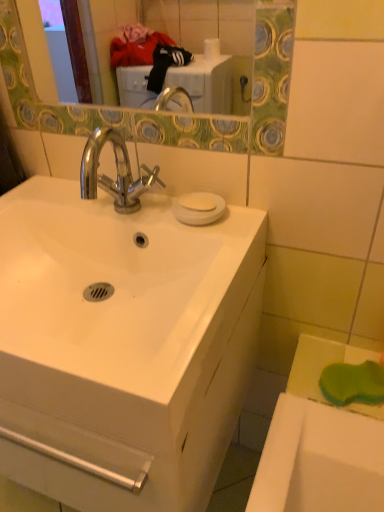
Question: Are white glossy sink at center and white matte soap at upper center beside each other?

Choices:
 (A) no
 (B) yes

Answer: (A)

Question: From a real-world perspective, does white glossy sink at center sit lower than white matte soap at upper center?

Choices:
 (A) no
 (B) yes

Answer: (B)

Question: Considering the relative positions of white glossy sink at center and white matte soap at upper center in the image provided, is white glossy sink at center to the left of white matte soap at upper center from the viewer's perspective?

Choices:
 (A) no
 (B) yes

Answer: (B)

Question: Considering the relative sizes of white glossy sink at center and white matte soap at upper center in the image provided, is white glossy sink at center shorter than white matte soap at upper center?

Choices:
 (A) yes
 (B) no

Answer: (B)

Question: Is white glossy sink at center bigger than white matte soap at upper center?

Choices:
 (A) no
 (B) yes

Answer: (B)

Question: Does point (66, 485) appear closer or farther from the camera than point (185, 202)?

Choices:
 (A) farther
 (B) closer

Answer: (B)

Question: Visually, is white glossy cabinet at center positioned to the left or to the right of white matte soap at upper center?

Choices:
 (A) right
 (B) left

Answer: (B)

Question: Considering their positions, is white glossy cabinet at center located in front of or behind white matte soap at upper center?

Choices:
 (A) behind
 (B) front

Answer: (B)

Question: Based on their sizes in the image, would you say white glossy cabinet at center is bigger or smaller than white matte soap at upper center?

Choices:
 (A) big
 (B) small

Answer: (A)

Question: From a real-world perspective, relative to white glossy sink at center, is white glossy cabinet at center vertically above or below?

Choices:
 (A) above
 (B) below

Answer: (B)

Question: Considering the positions of white glossy cabinet at center and white glossy sink at center in the image, is white glossy cabinet at center taller or shorter than white glossy sink at center?

Choices:
 (A) short
 (B) tall

Answer: (B)

Question: From the image's perspective, is white glossy cabinet at center positioned above or below white glossy sink at center?

Choices:
 (A) below
 (B) above

Answer: (A)

Question: Considering the positions of point (92, 481) and point (170, 347), is point (92, 481) closer or farther from the camera than point (170, 347)?

Choices:
 (A) farther
 (B) closer

Answer: (A)

Question: From a real-world perspective, relative to white glossy sink at center, is white matte soap at upper center vertically above or below?

Choices:
 (A) above
 (B) below

Answer: (A)

Question: Relative to white glossy sink at center, is white matte soap at upper center in front or behind?

Choices:
 (A) front
 (B) behind

Answer: (B)